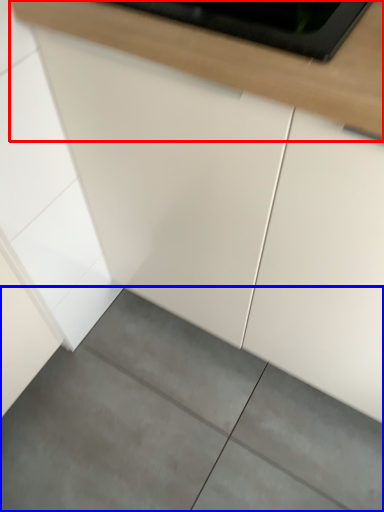
Question: Which object is further to the camera taking this photo, countertop (highlighted by a red box) or concrete (highlighted by a blue box)?

Choices:
 (A) countertop
 (B) concrete

Answer: (B)